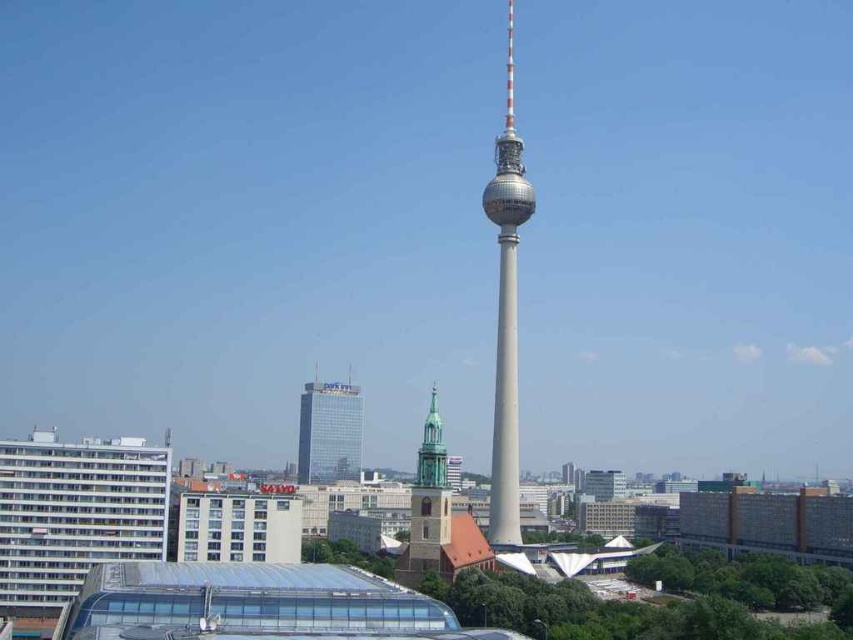
Question: Can you confirm if smooth gray tower at center is bigger than glassy metallic skyscraper at center?

Choices:
 (A) no
 (B) yes

Answer: (B)

Question: Which of these objects is positioned farthest from the glassy metallic skyscraper at center?

Choices:
 (A) brown stone church steeple at center
 (B) smooth gray tower at center

Answer: (A)

Question: Considering the relative positions of glassy metallic skyscraper at center and brown stone church steeple at center in the image provided, where is glassy metallic skyscraper at center located with respect to brown stone church steeple at center?

Choices:
 (A) left
 (B) right

Answer: (A)

Question: Does glassy metallic skyscraper at center appear under brown stone church steeple at center?

Choices:
 (A) no
 (B) yes

Answer: (B)

Question: Which point appears closest to the camera in this image?

Choices:
 (A) [421, 464]
 (B) [511, 337]
 (C) [341, 442]

Answer: (A)

Question: Among these points, which one is farthest from the camera?

Choices:
 (A) (521, 214)
 (B) (404, 557)

Answer: (A)